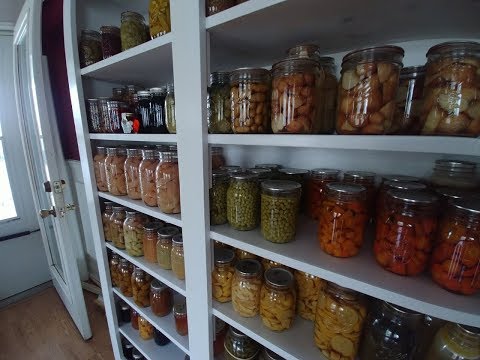
Identify the location of shelf. (258, 340), (261, 320).